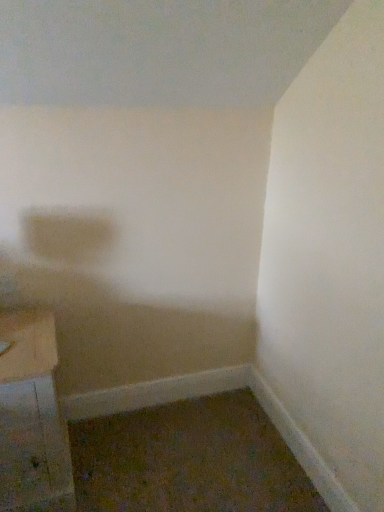
In order to click on empty space that is ontop of wooden file cabinet at lower left (from a real-world perspective) in this screenshot , I will do `click(23, 334)`.